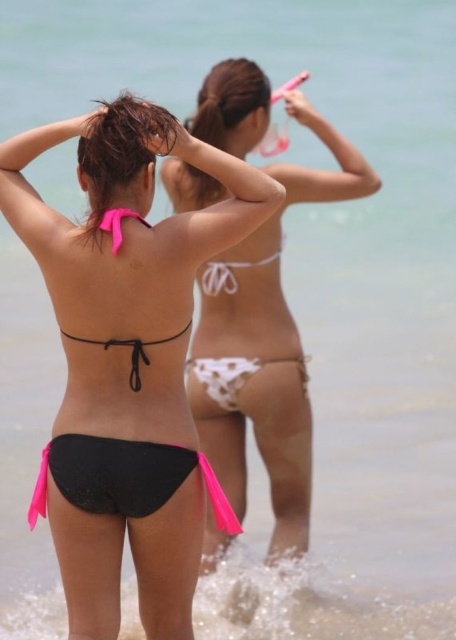
Is white matte bikini bottom at center to the left of white polka dot bikini at center from the viewer's perspective?

Incorrect, white matte bikini bottom at center is not on the left side of white polka dot bikini at center.

Is point (280, 317) farther from viewer compared to point (188, 360)?

No.

What do you see at coordinates (264, 346) in the screenshot?
I see `white matte bikini bottom at center` at bounding box center [264, 346].

Identify the location of white matte bikini bottom at center. This screenshot has width=456, height=640. (264, 346).

Looking at this image, between white polka dot bikini at center and pink satin bikini top at upper center, which one appears on the right side from the viewer's perspective?

white polka dot bikini at center

Who is more forward, (218, 396) or (104, 211)?

Positioned in front is point (104, 211).

The width and height of the screenshot is (456, 640). What are the coordinates of `white polka dot bikini at center` in the screenshot? It's located at (236, 374).

Is white matte bikini bottom at center in front of pink satin bikini top at upper center?

No, it is behind pink satin bikini top at upper center.

In the scene shown: Who is more forward, (288, 452) or (118, 214)?

Positioned in front is point (118, 214).

Is point (241, 282) positioned after point (129, 214)?

Yes, it is.

At what (x,y) coordinates should I click in order to perform the action: click on white matte bikini bottom at center. Please return your answer as a coordinate pair (x, y). Looking at the image, I should click on (264, 346).